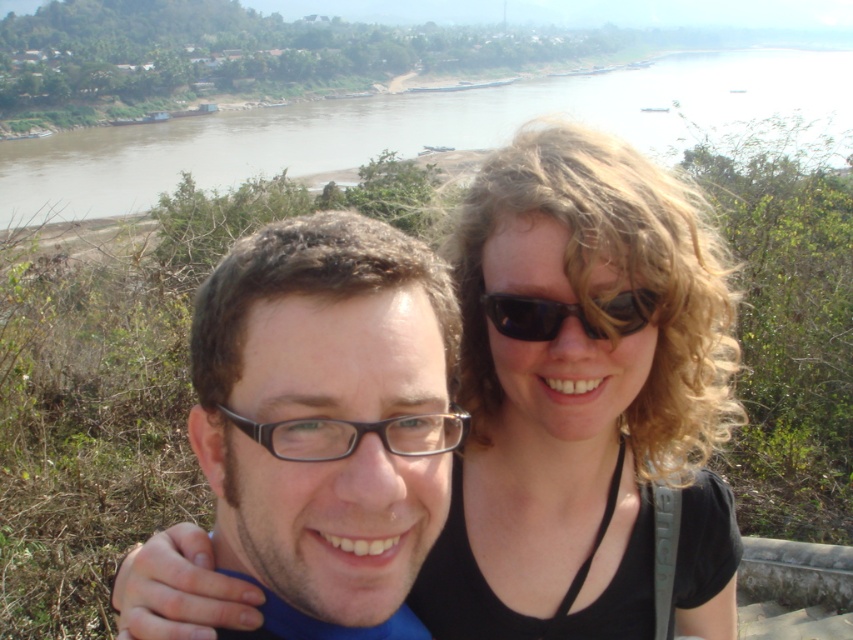
You are a photographer trying to capture the scenic river in the image. The brown muddy water at upper center is crucial for the shot. Can you confirm its exact location using coordinates?

The brown muddy water at upper center is located at coordinates point (415, 129).

You are taking a photo of two people standing at the center of the image. You notice the black matte hair at center and the black plastic sunglasses at center. Which object is closer to the camera?

The black matte hair at center is closer to the camera because it is in front of the black plastic sunglasses at center.

You are a photographer trying to capture a clear shot of the black plastic glasses at center without the brown muddy water at upper center blocking the view. Is there a way to adjust your position so that the glasses are visible without the water in the frame?

The brown muddy water at upper center is located above the black plastic glasses at center, so if you lower your camera angle or move your position downward, you can frame the shot to exclude the water above and focus solely on the glasses.